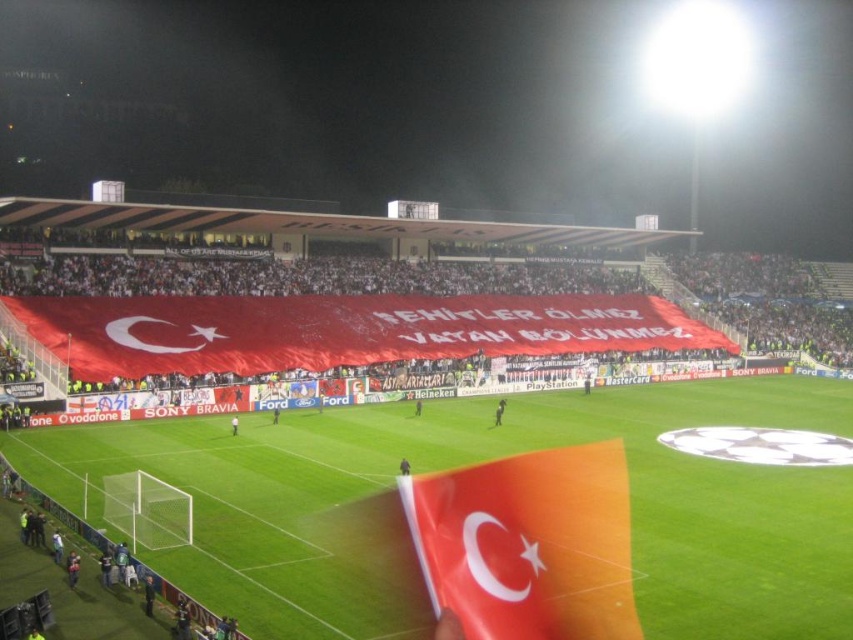
Question: Which point is closer to the camera taking this photo?

Choices:
 (A) (421, 506)
 (B) (419, 404)

Answer: (A)

Question: Is green grass football field at center to the left of dark blue jersey at center from the viewer's perspective?

Choices:
 (A) yes
 (B) no

Answer: (B)

Question: Does green grass football field at center have a lesser width compared to dark blue jersey at center?

Choices:
 (A) yes
 (B) no

Answer: (B)

Question: Which point appears farthest from the camera in this image?

Choices:
 (A) (503, 401)
 (B) (276, 410)
 (C) (669, 406)

Answer: (C)

Question: Is matte orange flag at lower right above smooth skin person at center?

Choices:
 (A) no
 (B) yes

Answer: (A)

Question: Which of the following is the closest to the observer?

Choices:
 (A) (618, 465)
 (B) (264, 454)
 (C) (415, 410)
 (D) (408, 461)

Answer: (D)